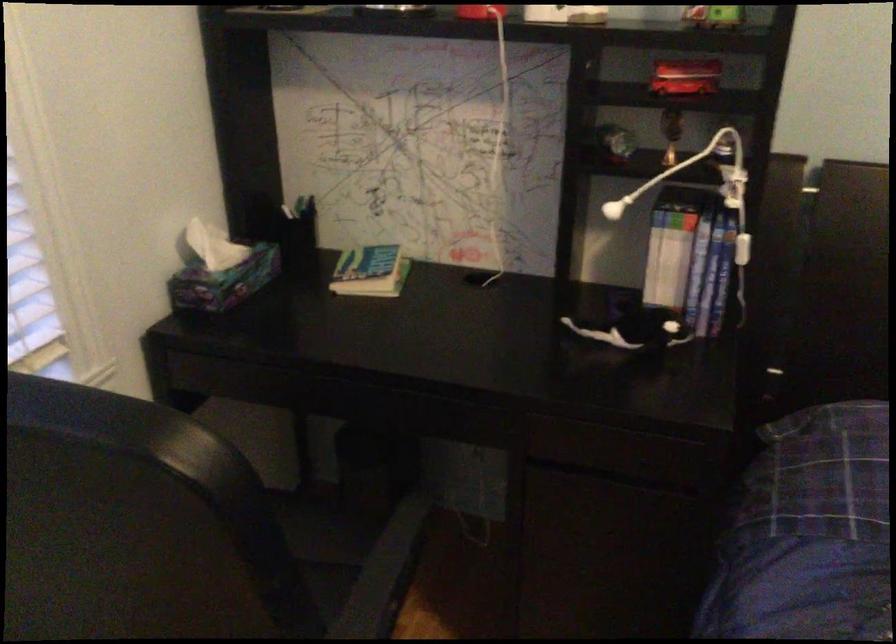
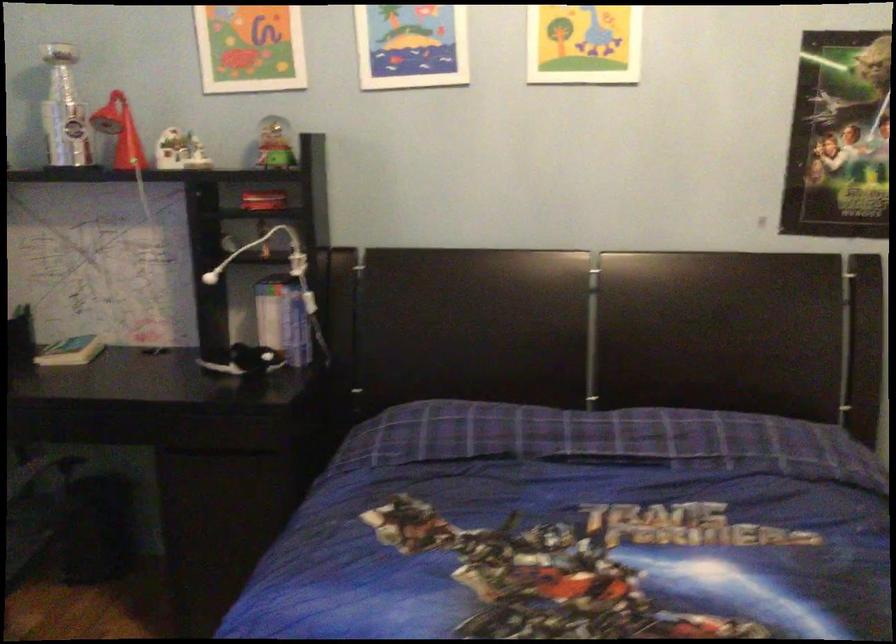
Which direction would the cameraman need to move to produce the second image?

The cameraman moved toward right, backward.